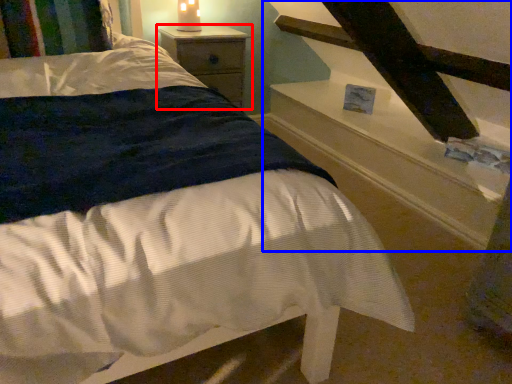
Question: Which object appears farthest to the camera in this image, nightstand (highlighted by a red box) or stairwell (highlighted by a blue box)?

Choices:
 (A) nightstand
 (B) stairwell

Answer: (A)